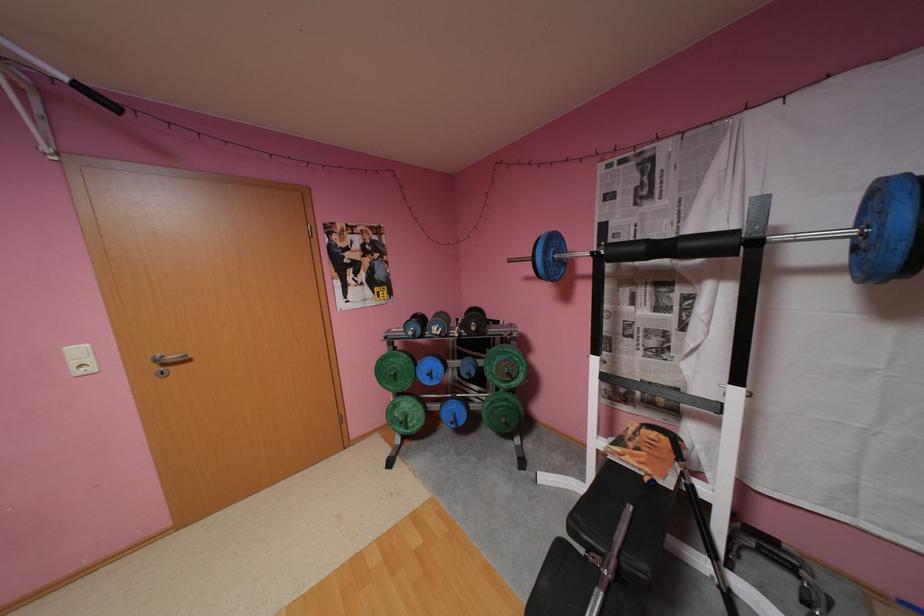
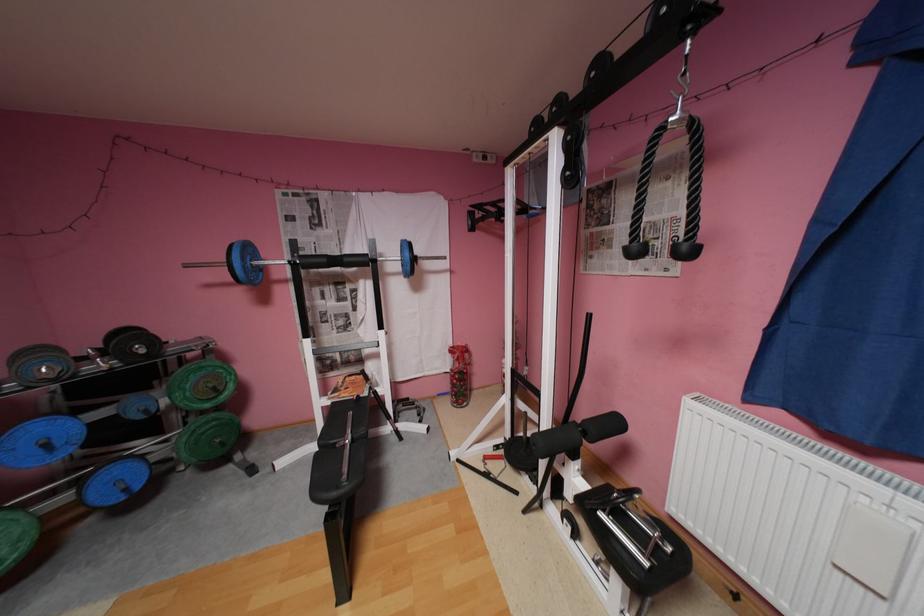
The point at (x=439, y=374) is marked in the first image. Where is the corresponding point in the second image?

(55, 445)